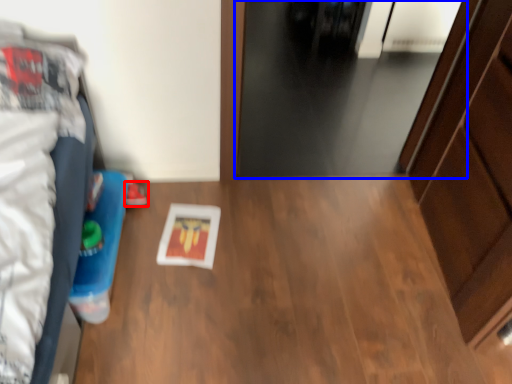
Question: Which object appears farthest to the camera in this image, footwear (highlighted by a red box) or door (highlighted by a blue box)?

Choices:
 (A) footwear
 (B) door

Answer: (B)